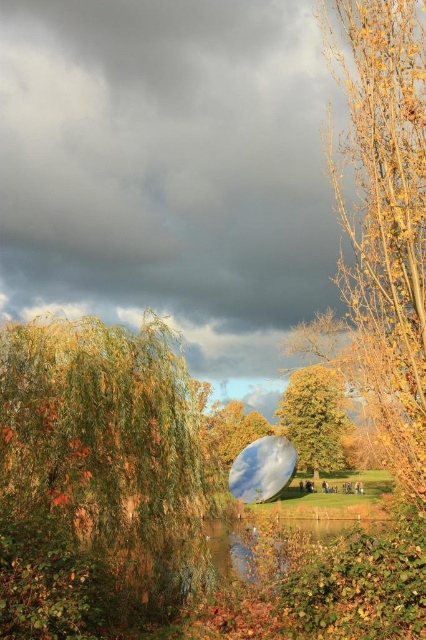
Question: Considering the relative positions of golden textured tree at center and transparent glass bubble at center in the image provided, where is golden textured tree at center located with respect to transparent glass bubble at center?

Choices:
 (A) right
 (B) left

Answer: (A)

Question: Can you confirm if golden leafy tree at left is positioned to the right of transparent glass bubble at center?

Choices:
 (A) no
 (B) yes

Answer: (A)

Question: Among these points, which one is farthest from the camera?

Choices:
 (A) (157, 387)
 (B) (310, 440)
 (C) (276, 490)
 (D) (233, 536)

Answer: (B)

Question: Estimate the real-world distances between objects in this image. Which object is farther from the transparent glass water at center?

Choices:
 (A) golden leafy tree at left
 (B) transparent glass bubble at center
 (C) yellow leafy tree at right

Answer: (C)

Question: Which object is positioned farthest from the golden textured tree at center?

Choices:
 (A) golden leafy tree at left
 (B) yellow leafy tree at right
 (C) transparent glass water at center

Answer: (A)

Question: Does yellow leafy tree at right lie behind transparent glass water at center?

Choices:
 (A) no
 (B) yes

Answer: (A)